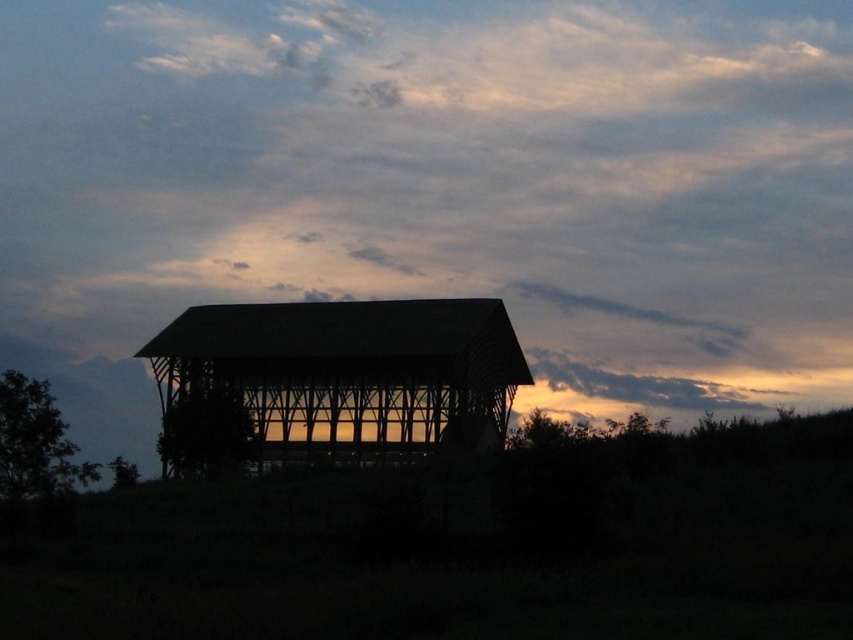
Question: Among these points, which one is nearest to the camera?

Choices:
 (A) (506, 332)
 (B) (281, 64)

Answer: (A)

Question: Is cloudy sky at upper center positioned before silhouette wood barn at center?

Choices:
 (A) yes
 (B) no

Answer: (B)

Question: Is cloudy sky at upper center wider than silhouette wood barn at center?

Choices:
 (A) no
 (B) yes

Answer: (B)

Question: Is cloudy sky at upper center to the left of silhouette wood barn at center from the viewer's perspective?

Choices:
 (A) no
 (B) yes

Answer: (A)

Question: Among these points, which one is farthest from the camera?

Choices:
 (A) (183, 164)
 (B) (503, 426)

Answer: (A)